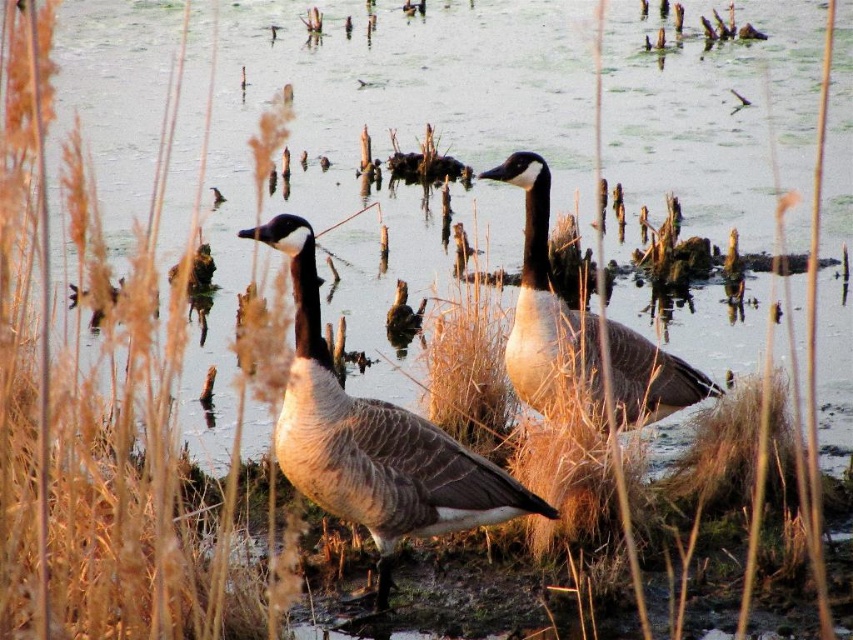
Question: Is matte gray duck at center closer to camera compared to white-feathered duck at center?

Choices:
 (A) yes
 (B) no

Answer: (A)

Question: Is brown grass at left below white-feathered duck at center?

Choices:
 (A) yes
 (B) no

Answer: (A)

Question: Considering the real-world distances, which object is closest to the matte gray duck at center?

Choices:
 (A) brown grass at left
 (B) white-feathered duck at center

Answer: (A)

Question: Is matte gray duck at center behind white-feathered duck at center?

Choices:
 (A) yes
 (B) no

Answer: (B)

Question: Based on their relative distances, which object is farther from the white-feathered duck at center?

Choices:
 (A) brown grass at left
 (B) matte gray duck at center

Answer: (A)

Question: Estimate the real-world distances between objects in this image. Which object is closer to the white-feathered duck at center?

Choices:
 (A) matte gray duck at center
 (B) brown grass at left

Answer: (A)